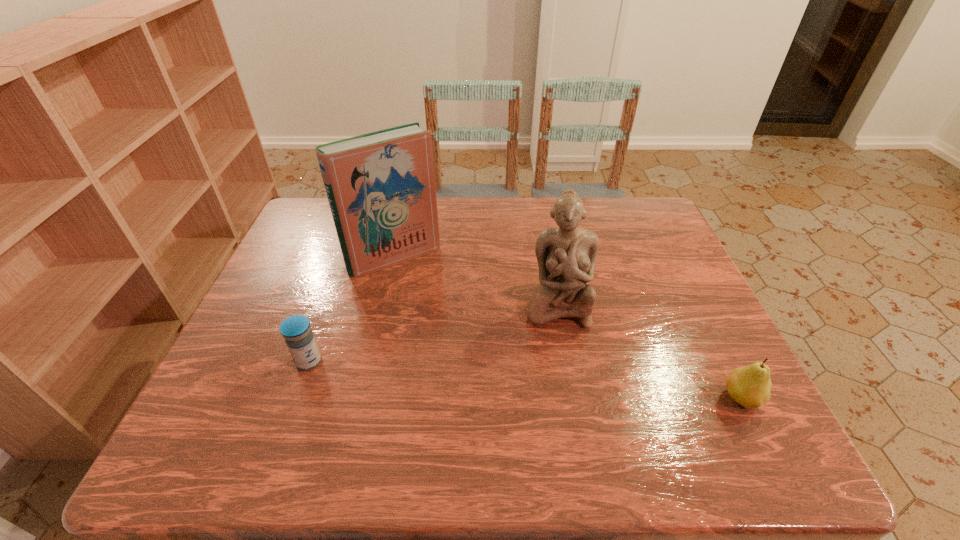
Where is `the second nearest object`? The width and height of the screenshot is (960, 540). the second nearest object is located at coordinates (296, 330).

Identify the location of pear. Image resolution: width=960 pixels, height=540 pixels. [750, 386].

This screenshot has height=540, width=960. Identify the location of the nearest object. (750, 386).

Where is `hardback book`? hardback book is located at coordinates (380, 186).

Where is `the tallest object`? The width and height of the screenshot is (960, 540). the tallest object is located at coordinates point(380,186).

Locate an element on the screen. the third object from left to right is located at coordinates (566, 255).

Identify the location of figurine. (566, 255).

Identify the location of free space located 0.350m on the right of the third farthest object. (479, 362).

The width and height of the screenshot is (960, 540). I want to click on vacant space located on the left of the nearest object, so tap(619, 399).

Locate an element on the screen. This screenshot has height=540, width=960. vacant area situated on the cover of the farthest object is located at coordinates (480, 365).